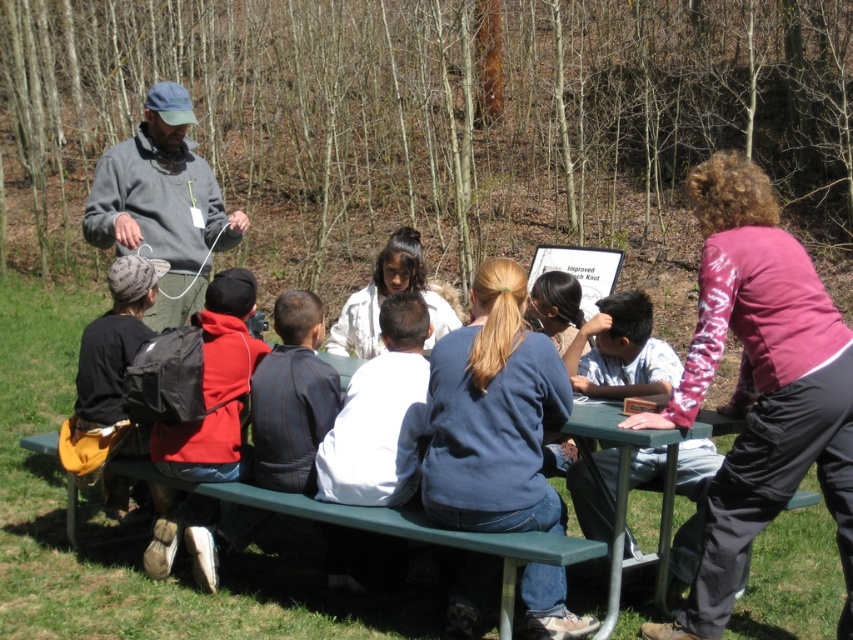
Question: Does gray fleece jacket at upper left appear over green painted wood table at lower center?

Choices:
 (A) no
 (B) yes

Answer: (B)

Question: Is gray fleece jacket at upper left closer to the viewer compared to green painted wood table at lower center?

Choices:
 (A) no
 (B) yes

Answer: (A)

Question: Observing the image, what is the correct spatial positioning of gray fleece jacket at upper left in reference to green painted wood table at lower center?

Choices:
 (A) below
 (B) above

Answer: (B)

Question: Which point is farther to the camera?

Choices:
 (A) (619, 500)
 (B) (148, 253)

Answer: (B)